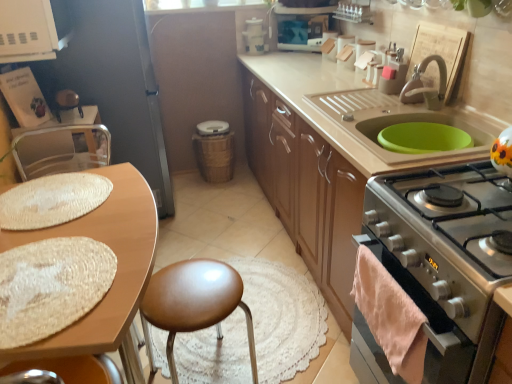
You are a GUI agent. You are given a task and a screenshot of the screen. Output one action in this format:
    pyautogui.click(x=<x>, y=<y>)
    Task: Click on the free space above brown leather stool at center (from a real-world perspective)
    
    Given the screenshot: What is the action you would take?
    pyautogui.click(x=189, y=286)